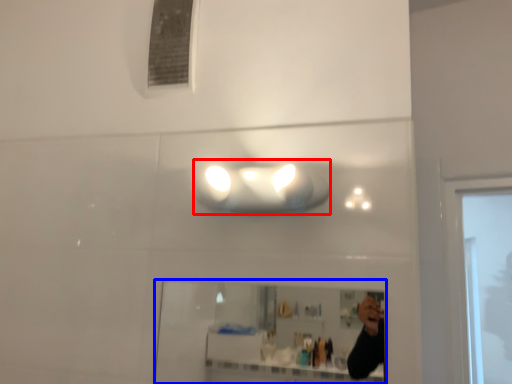
Question: Which of the following is the farthest to the observer, light fixture (highlighted by a red box) or mirror (highlighted by a blue box)?

Choices:
 (A) light fixture
 (B) mirror

Answer: (A)